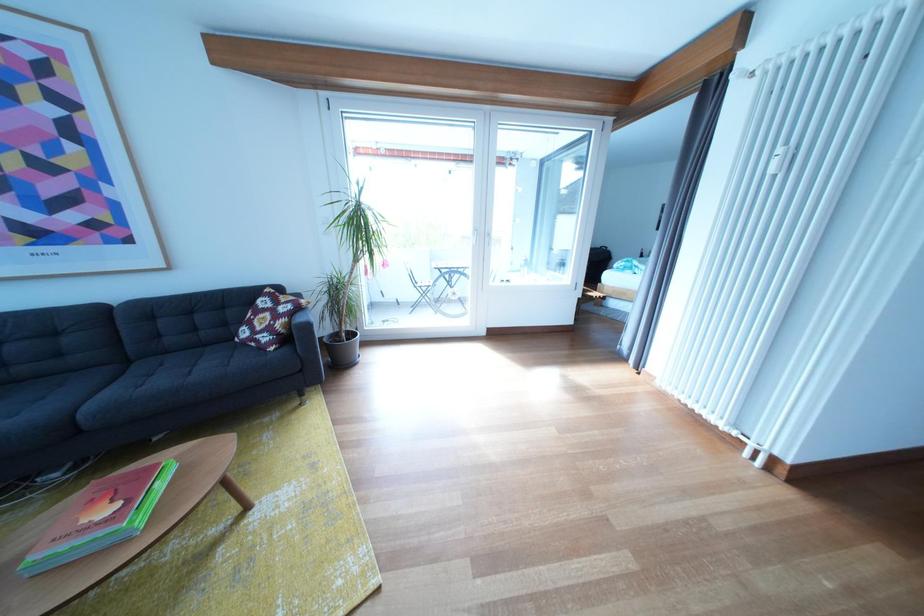
Where would you pull the white door handle? Please return your answer as a coordinate pair (x, y).

(779, 160)